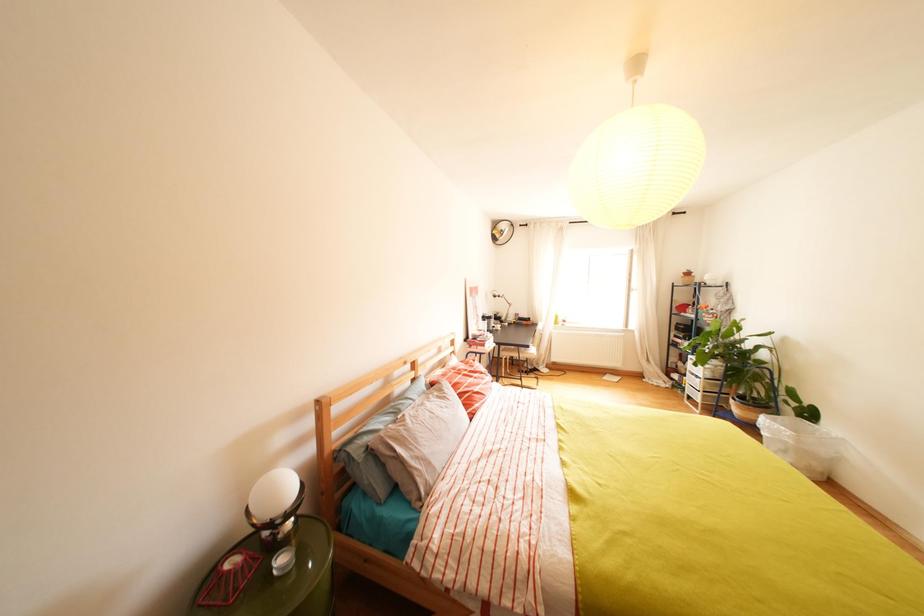
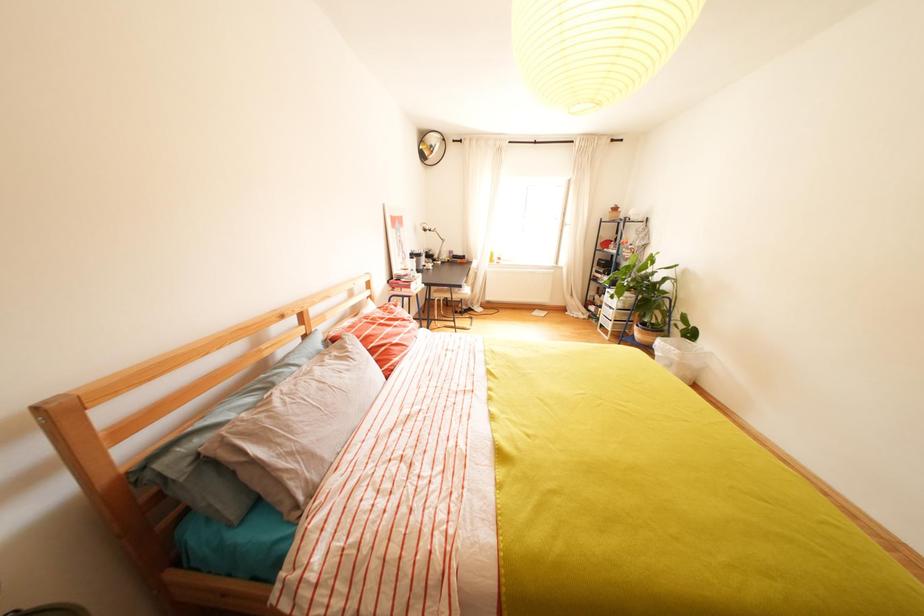
Question: The camera is either moving clockwise (left) or counter-clockwise (right) around the object. The first image is from the beginning of the video and the second image is from the end. Is the camera moving left or right when shooting the video?

Choices:
 (A) Left
 (B) Right

Answer: (A)